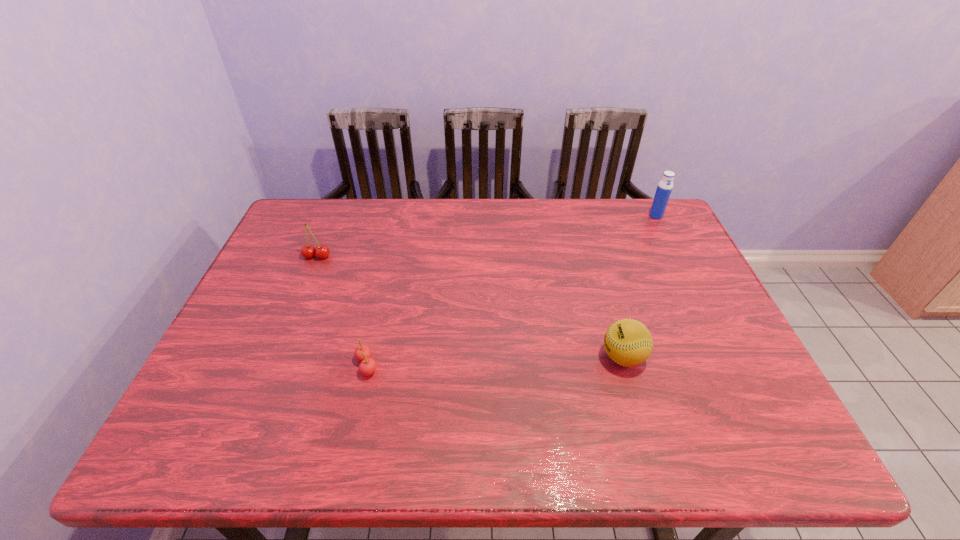
In the image, there is a desktop. Where is `vacant area at the right edge`? The height and width of the screenshot is (540, 960). vacant area at the right edge is located at coordinates (702, 344).

In the image, there is a desktop. Where is `free space at the far left corner`? This screenshot has height=540, width=960. free space at the far left corner is located at coordinates (326, 229).

Where is `blank space at the near left corner of the desktop`? The image size is (960, 540). blank space at the near left corner of the desktop is located at coordinates (226, 428).

You are a GUI agent. You are given a task and a screenshot of the screen. Output one action in this format:
    pyautogui.click(x=<x>, y=<y>)
    Task: Click on the vacant space at the far right corner of the desktop
    The height and width of the screenshot is (540, 960).
    Given the screenshot: What is the action you would take?
    [x=649, y=238]

The width and height of the screenshot is (960, 540). What are the coordinates of `free spot at the near right corner of the desktop` in the screenshot? It's located at (782, 439).

The image size is (960, 540). Identify the location of free space between the left cherry and the shortest object. (342, 311).

The height and width of the screenshot is (540, 960). Find the location of `vacant region between the left cherry and the shortest object`. vacant region between the left cherry and the shortest object is located at coordinates (342, 311).

Find the location of a particular element. The width and height of the screenshot is (960, 540). vacant space in between the second farthest object and the softball is located at coordinates (470, 307).

The height and width of the screenshot is (540, 960). Identify the location of free space that is in between the nearer cherry and the softball. (495, 361).

At what (x,y) coordinates should I click in order to perform the action: click on free spot between the water bottle and the farther cherry. Please return your answer as a coordinate pair (x, y). This screenshot has height=540, width=960. Looking at the image, I should click on (487, 236).